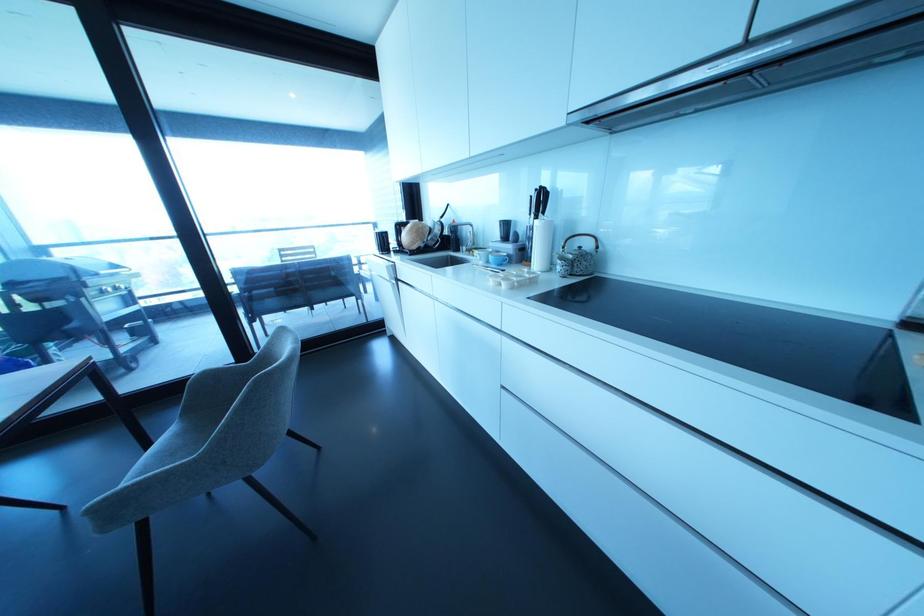
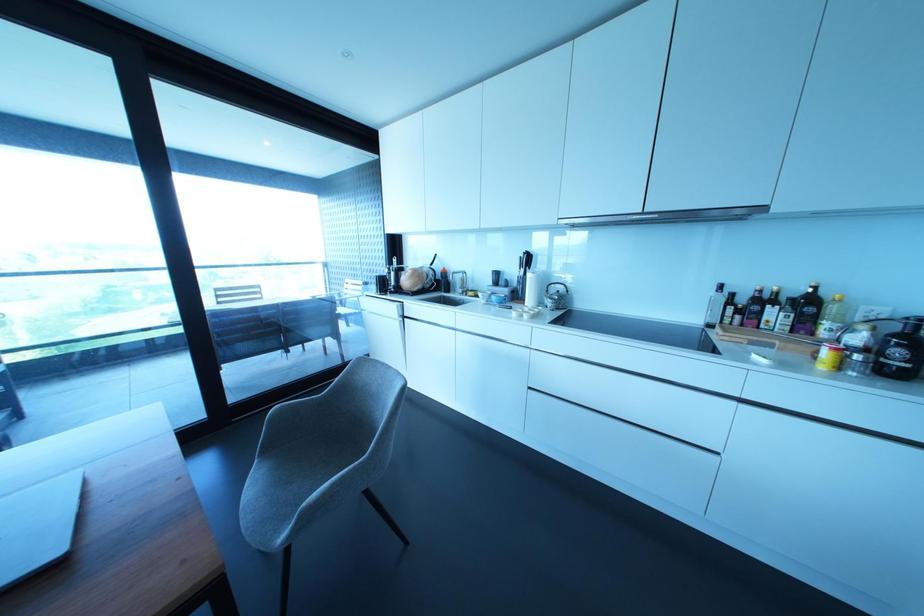
The images are taken continuously from a first-person perspective. In which direction are you moving?

The movement direction of the cameraman is left, backward.